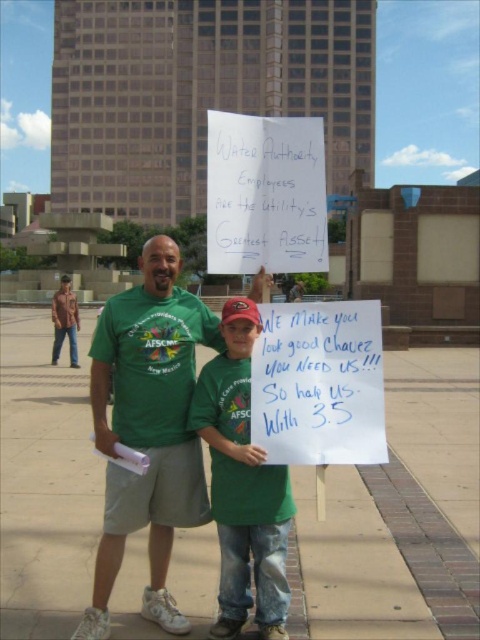
What is the exact 2D coordinate of the green fabric shirt at center in the image?

The green fabric shirt at center is located at the 2D coordinate point of (147, 428).

You are a photographer standing in the plaza and want to take a picture of the green fabric shirt at center. Where should you position your camera to capture the shirt in the best possible way?

To capture the green fabric shirt at center optimally, position the camera directly facing the shirt at point [147,428], ensuring it is centered in the frame for maximum visibility.